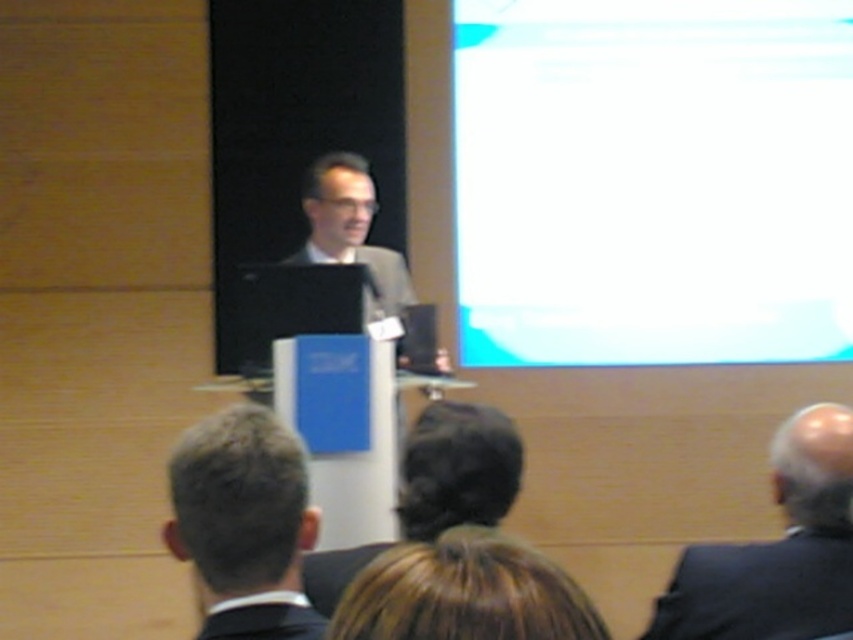
You are an attendee at this presentation. You need to locate the speaker who has dark brown hair at center and is wearing a black matte suit at lower center. Where would you look first to find the speaker?

The dark brown hair at center is located above the black matte suit at lower center, so you should look at the area where the dark brown hair at center is positioned above the black matte suit at lower center to find the speaker.

You are an event planner organizing a conference. You need to ensure that the speaker with dark brown hair at center and the attendee in black matte suit at lower center can see each other clearly. Based on their positions and the objects described, is there any obstruction between them?

The dark brown hair at center is wider than the black matte suit at lower center. Since the speaker is at the center and the attendee is at the lower center, there might be a slight obstruction due to the difference in width, but the main obstruction would be the podium and other attendees in front. However, the description does not mention any physical barriers between them, so they should have a clear line of sight.

You are an event organizer and need to seat the black matte suit at lower right and the dark brown hair at center appropriately. Considering their sizes, which one requires a larger seat?

The dark brown hair at center requires a larger seat because it has a bigger size compared to the black matte suit at lower right.